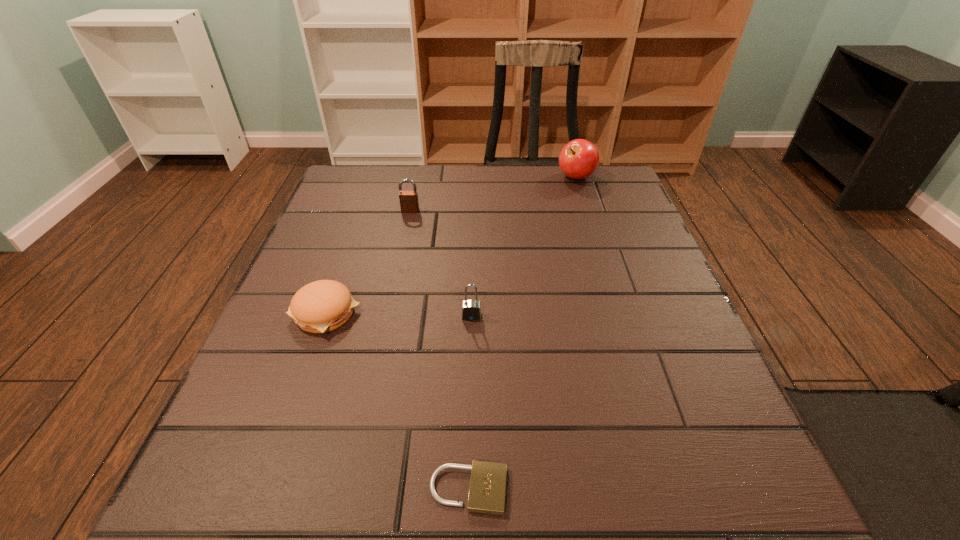
This screenshot has width=960, height=540. I want to click on vacant position at the far edge of the desktop, so click(466, 170).

At what (x,y) coordinates should I click in order to perform the action: click on blank space at the near edge of the desktop. Please return your answer as a coordinate pair (x, y). Looking at the image, I should click on (432, 522).

Image resolution: width=960 pixels, height=540 pixels. Identify the location of free space at the left edge of the desktop. (303, 331).

Where is `vacant region at the right edge of the desktop`? Image resolution: width=960 pixels, height=540 pixels. vacant region at the right edge of the desktop is located at coordinates (614, 318).

You are a GUI agent. You are given a task and a screenshot of the screen. Output one action in this format:
    pyautogui.click(x=<x>, y=<y>)
    Task: Click on the vacant space at the far right corner
    This screenshot has height=540, width=960.
    Given the screenshot: What is the action you would take?
    pyautogui.click(x=618, y=191)

This screenshot has width=960, height=540. Find the location of `vacant space at the near right corner of the desktop`. vacant space at the near right corner of the desktop is located at coordinates (754, 471).

What are the coordinates of `unoccupied position between the nearest padlock and the second farthest padlock` in the screenshot? It's located at (470, 403).

This screenshot has width=960, height=540. I want to click on empty location between the second farthest padlock and the farthest object, so point(524,247).

This screenshot has width=960, height=540. Find the location of `empty space that is in between the tallest object and the farthest padlock`. empty space that is in between the tallest object and the farthest padlock is located at coordinates (493, 194).

Where is `free space between the leftmost object and the tallest object`? The image size is (960, 540). free space between the leftmost object and the tallest object is located at coordinates (451, 245).